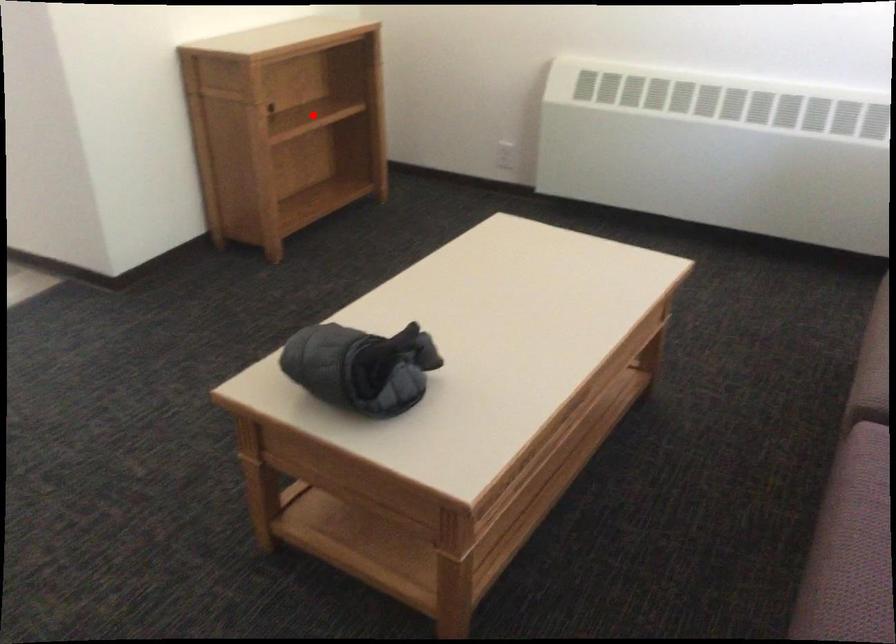
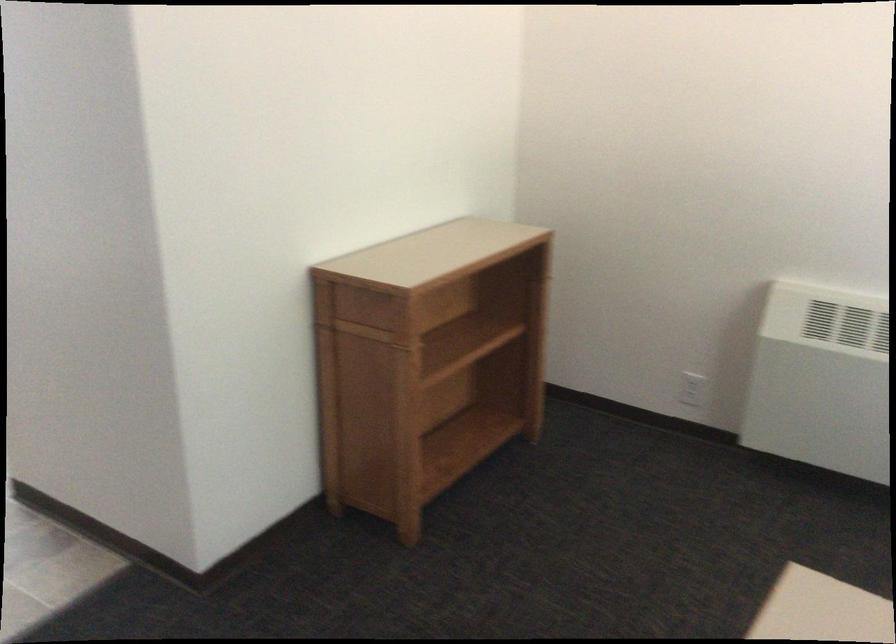
Question: I am providing you with two images of the same scene from different viewpoints. A red point is shown in image1. For the corresponding object point in image2, is it positioned nearer or farther from the camera?

Choices:
 (A) Nearer
 (B) Farther

Answer: (A)